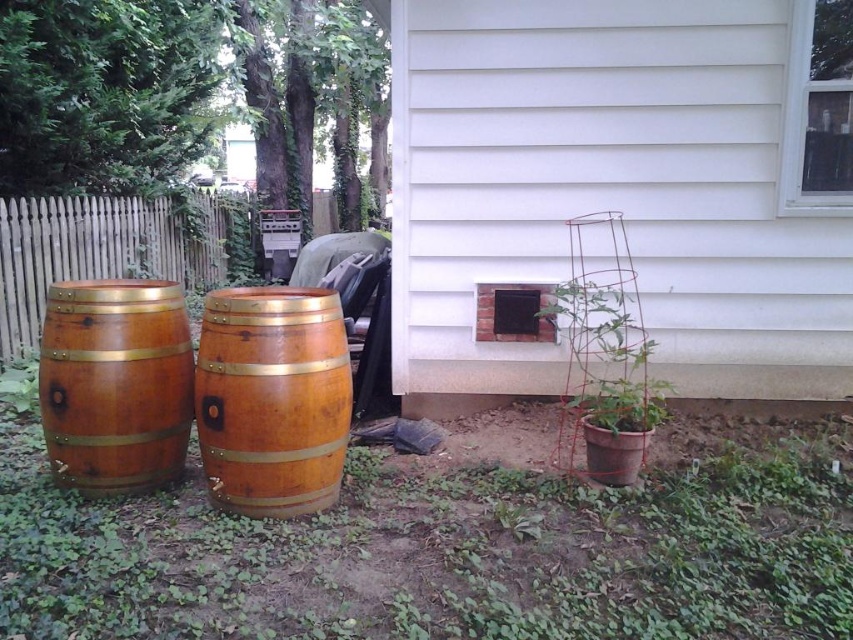
You are a gardener who wants to place a new plant stand that is 1.2 meters tall. You have two options in the scene, the wooden barrel at left and the green mesh trellis at lower right. Which one can support the plant stand without it being too short?

The wooden barrel at left is taller than the green mesh trellis at lower right. Since the plant stand is 1.2 meters tall, the wooden barrel at left would be the better option as it is taller and can support the plant stand without it being too short.

You are trying to decide whether to place a small potted plant between the brick at lower right and the brown wooden fence at left. Which object should the plant be closer to if you want it to be near the smaller one?

The brick at lower right is smaller than the brown wooden fence at left, so the plant should be placed closer to the brick at lower right.